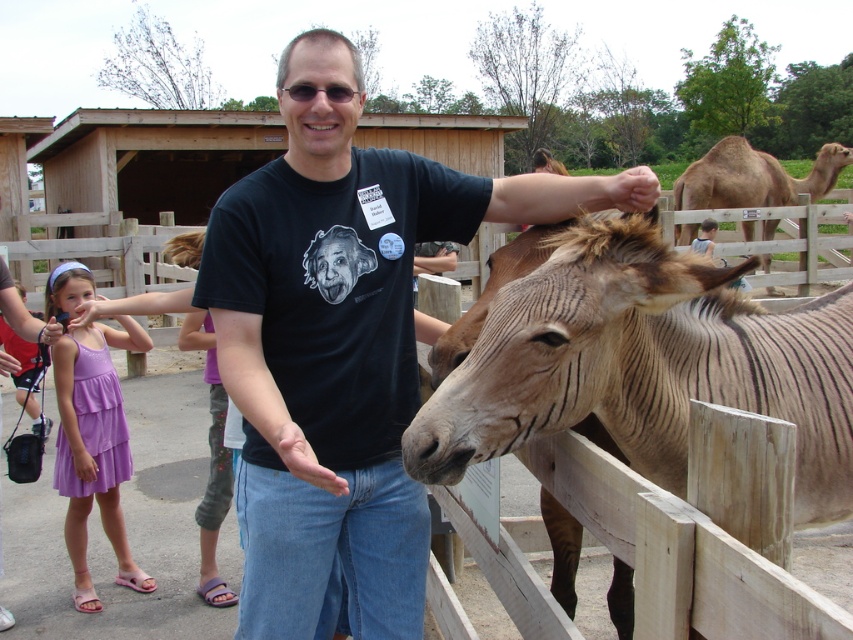
You are a photographer at the zoo and need to capture a photo of the purple cotton dress at lower left and the matte black hand at upper center. Which object should you focus on first if you want to include both in your frame without moving the camera?

The purple cotton dress at lower left is bigger than the matte black hand at upper center, so you should focus on the purple cotton dress at lower left first to ensure it fits properly in the frame before adjusting for the smaller matte black hand at upper center.